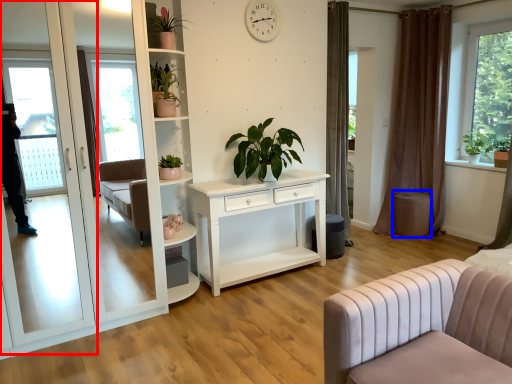
Question: Which object appears closest to the camera in this image, screen door (highlighted by a red box) or stool (highlighted by a blue box)?

Choices:
 (A) screen door
 (B) stool

Answer: (A)